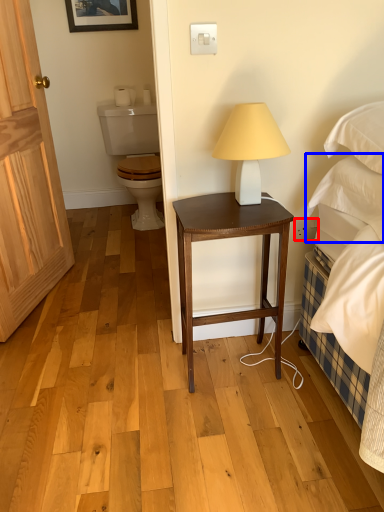
Question: Which object appears farthest to the camera in this image, power outlet (highlighted by a red box) or pillow (highlighted by a blue box)?

Choices:
 (A) power outlet
 (B) pillow

Answer: (A)